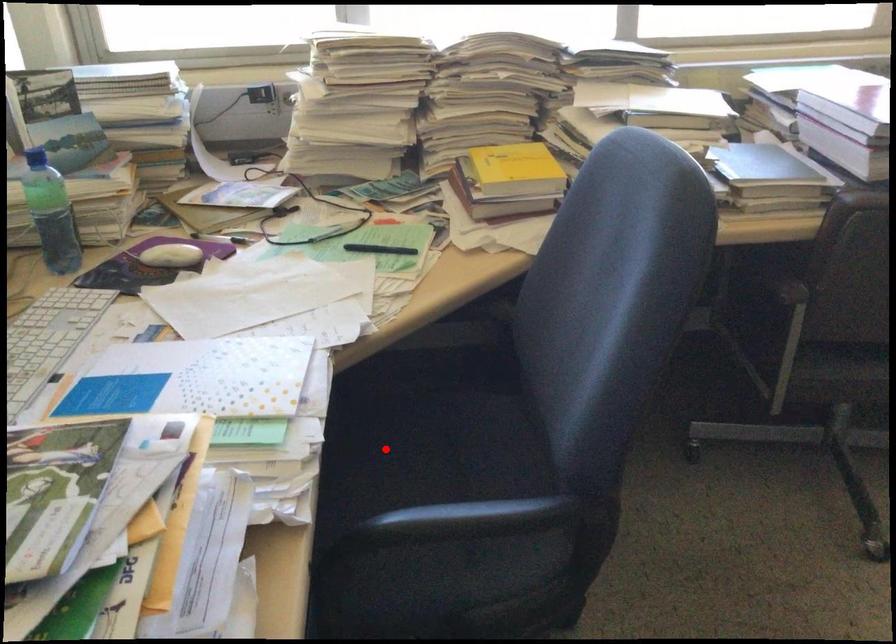
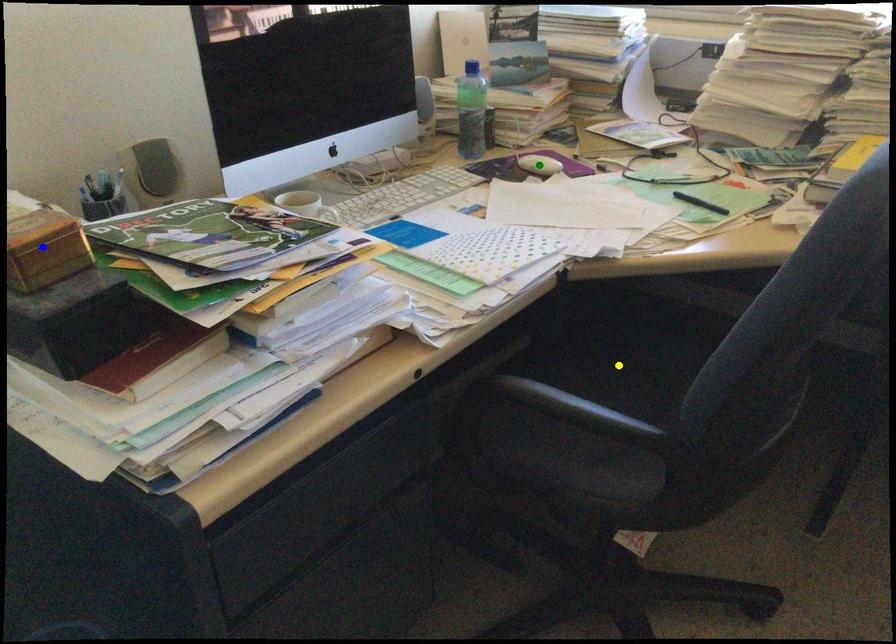
Question: I am providing you with two images of the same scene from different viewpoints. A red point is marked on the first image. You are given multiple points on the second image. Which point in image 2 represents the same 3d spot as the red point in image 1?

Choices:
 (A) green point
 (B) yellow point
 (C) blue point

Answer: (B)